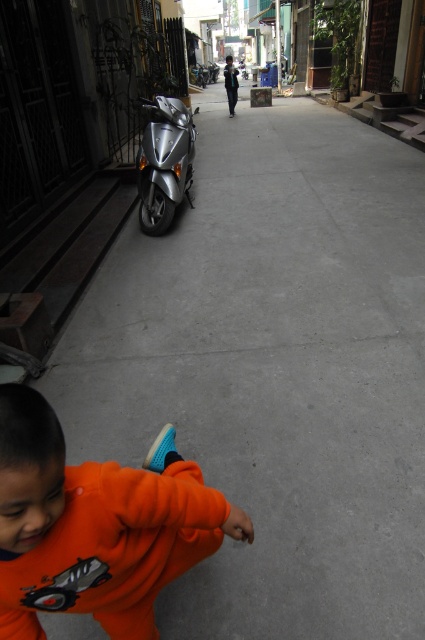
In the scene shown: You are a delivery person in the alleyway and need to deliver a package to the orange fleece at lower left located at point (96, 525). The alley is narrow. Can you estimate if your 1.2 meter wide delivery cart can pass through the narrowest part of the alley?

The orange fleece at lower left is located at point (96, 525). However, the provided information does not specify the width of the narrowest part of the alley. Without this measurement, it is impossible to determine if the 1.2 meter wide delivery cart can pass through.

You are a delivery person carrying a package and need to pass through the narrow alleyway. The point at coordinate (144, 612) is where you need to place your package. However, there is an obstacle at the other point. How far apart are the two points?

The two points are 1.31 meters apart.